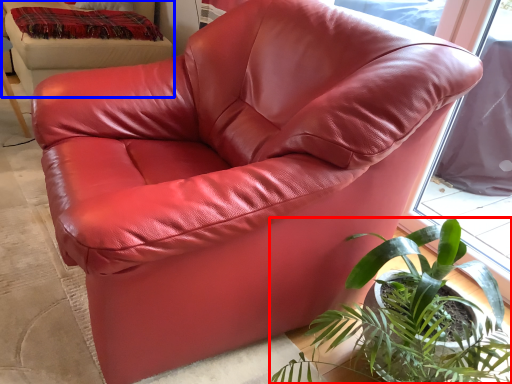
Question: Which point is closer to the camera, houseplant (highlighted by a red box) or bean bag chair (highlighted by a blue box)?

Choices:
 (A) houseplant
 (B) bean bag chair

Answer: (A)